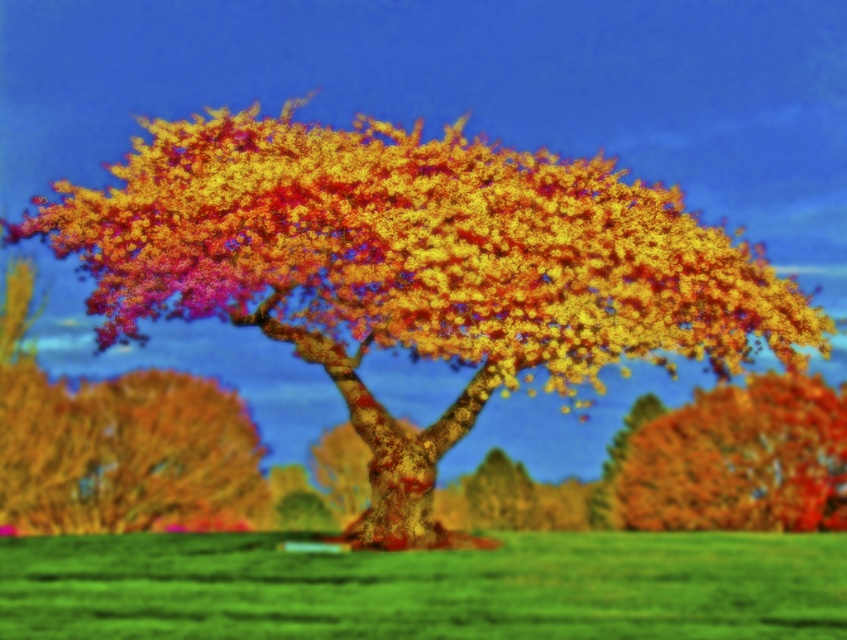
Which is above, multicolored bark tree at center or shiny multicolored leaves at center?

multicolored bark tree at center

In the scene shown: Is multicolored bark tree at center to the right of shiny multicolored leaves at center from the viewer's perspective?

Yes, multicolored bark tree at center is to the right of shiny multicolored leaves at center.

Is point (89, 304) positioned before point (43, 524)?

Yes, it is.

The image size is (847, 640). What are the coordinates of `multicolored bark tree at center` in the screenshot? It's located at (414, 268).

Is shiny multicolored leaves at center to the right of autumn leaves at right from the viewer's perspective?

No, shiny multicolored leaves at center is not to the right of autumn leaves at right.

Does shiny multicolored leaves at center come in front of autumn leaves at right?

That is True.

Does point (103, 499) lie behind point (645, 513)?

No, (103, 499) is closer to viewer.

The width and height of the screenshot is (847, 640). What are the coordinates of `shiny multicolored leaves at center` in the screenshot? It's located at [117, 444].

Looking at this image, who is taller, multicolored bark tree at center or autumn leaves at right?

autumn leaves at right

Between point (579, 164) and point (768, 474), which one is positioned behind?

Point (768, 474)

Find the location of `multicolored bark tree at center`. multicolored bark tree at center is located at coordinates pos(414,268).